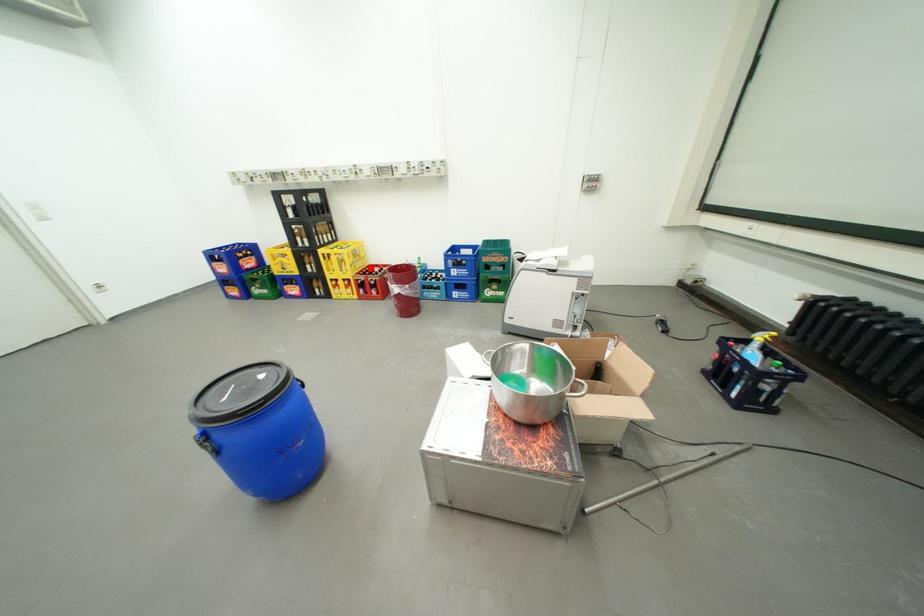
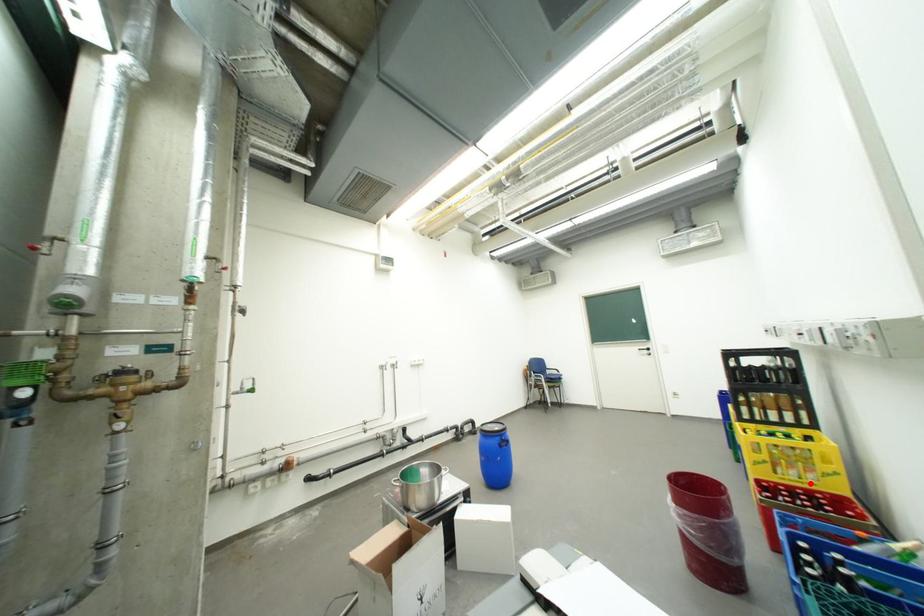
I am providing you with two images of the same scene from different viewpoints. A red point is marked on the first image and another point is marked on the second image. Is the red point in image1 aligned with the point shown in image2?

Yes